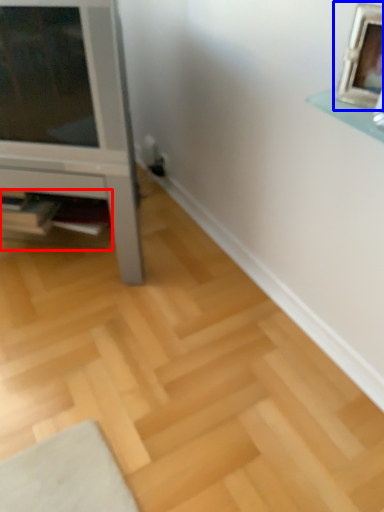
Question: Which object is closer to the camera taking this photo, shelf (highlighted by a red box) or picture frame (highlighted by a blue box)?

Choices:
 (A) shelf
 (B) picture frame

Answer: (B)